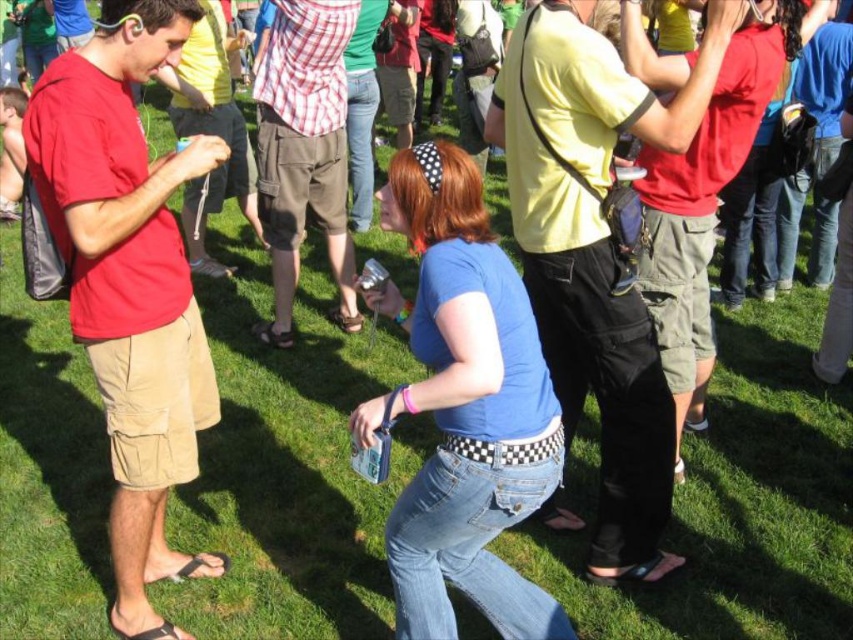
You are a photographer standing at the back of the scene. You want to take a photo of both the yellow cotton shirt at center and the checkered fabric shirt at center in the same frame. The minimum distance between them for your camera to focus on both is 2 meters. Can you capture both in focus?

The yellow cotton shirt at center and checkered fabric shirt at center are 2.10 meters apart from each other, so yes, the photographer can capture both in focus since the distance between them meets the camera requirement of 2 meters.

You are standing in the festival area and see the matte khaki shorts at left and the yellow cotton shirt at center. Which of these two items is closer to you?

The matte khaki shorts at left is closer to you because it is in front of the yellow cotton shirt at center.

You are standing in the grassy area and want to hand a flyer to the person wearing the matte khaki shorts at left. Which direction should you walk to reach them?

The matte khaki shorts at left is located at point 0.442 on the x and 0.152 on the y coordinate. Since the person is on the left side of the image, you should walk towards the left to reach them.